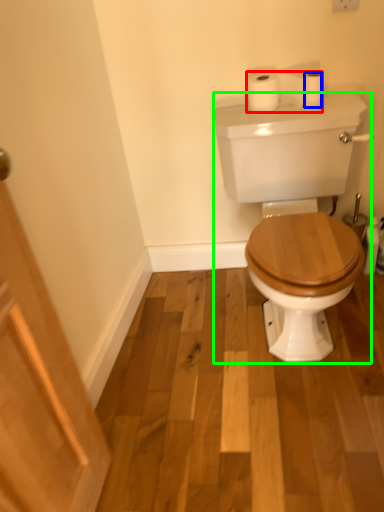
Question: Estimate the real-world distances between objects in this image. Which object is closer to toilet paper (highlighted by a red box), toilet paper (highlighted by a blue box) or porcelain (highlighted by a green box)?

Choices:
 (A) toilet paper
 (B) porcelain

Answer: (A)